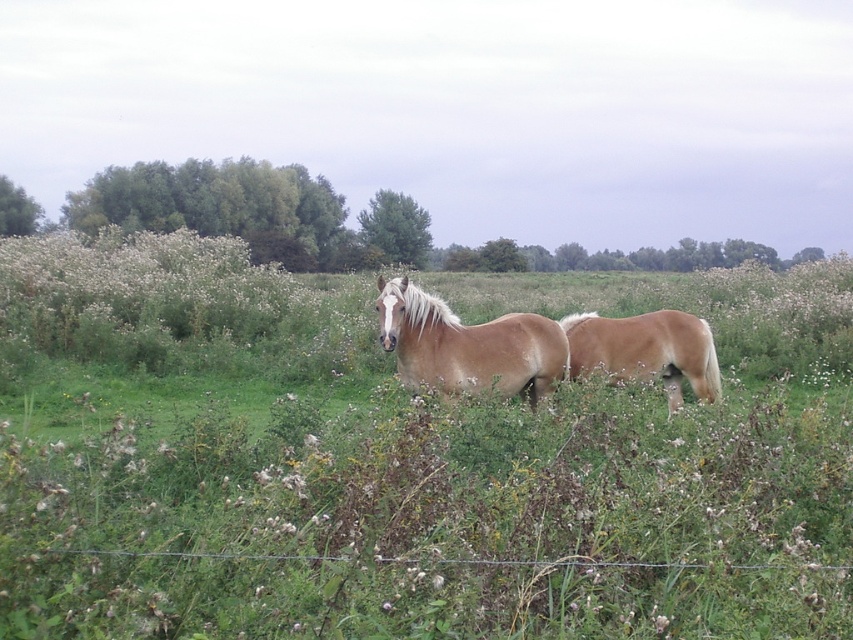
You are a farmer checking the height of your horses. You have a stable door that is 1.5 meters tall. Can both the brown matte horse at center and the light brown horse at center fit through the door without bending?

The brown matte horse at center is taller than the light brown horse at center. Since the stable door is 1.5 meters tall, we need to know the exact height of the taller horse to determine if it can fit. However, the description only states the relative height between them, not their actual measurements. Therefore, it is impossible to confirm if they can pass through without additional information.

You are standing in the field and see the point marked at coordinates (467, 346). What object is located at that point?

The point at coordinates (467, 346) corresponds to the brown matte horse at center.

You are a farmer checking the health of your horses. You notice that the brown matte horse at center and the light brown horse at center are both in the field. Which horse would you need to provide more feed to based on their size?

The brown matte horse at center is bigger than the light brown horse at center, so you should provide more feed to the brown matte horse at center.